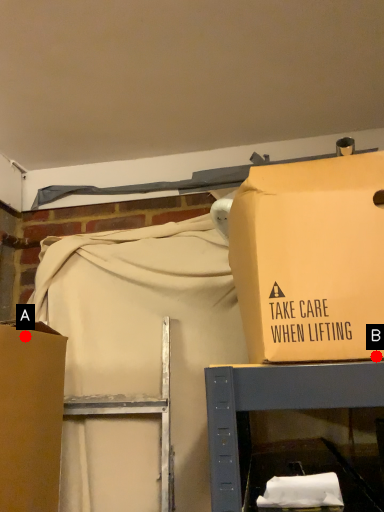
Question: Two points are circled on the image, labeled by A and B beside each circle. Which point is farther from the camera taking this photo?

Choices:
 (A) A is further
 (B) B is further

Answer: (A)